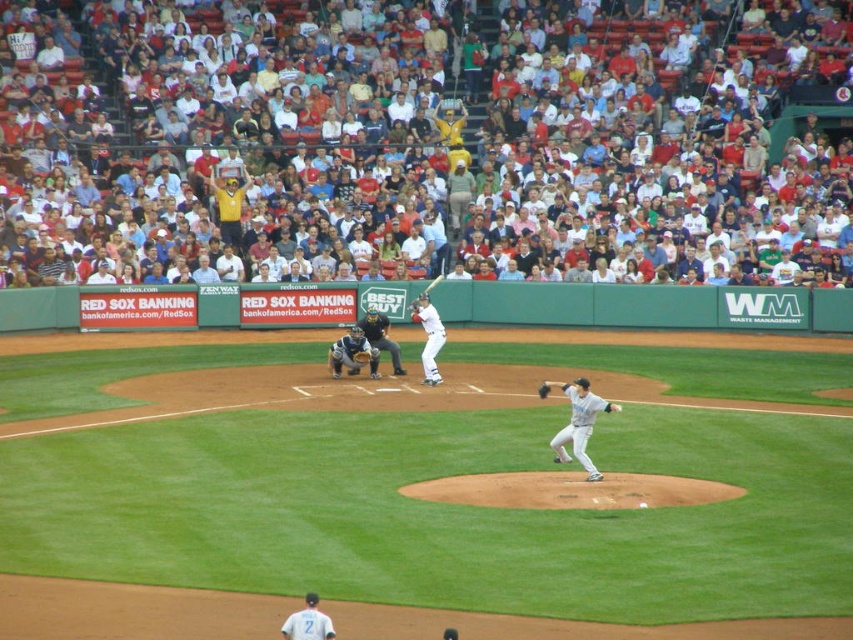
You are a baseball coach who wants to ensure proper positioning during a game. Given the distance between the blue leather catcher at center and the white jersey at center, is this distance within the standard MLB regulation of 60 feet, 6 inches between the pitcher and home plate?

The distance between the blue leather catcher at center and the white jersey at center is 49.75 feet, which is shorter than the MLB regulation of 60 feet, 6 inches. Therefore, the positioning is not compliant with the standard MLB regulation.

You are a baseball fan watching the game at Fenway Park. You notice two points marked on the field. The first point is at coordinate point(349, 358) and the second is at point(322, 625). From your perspective, which point is closer to the batter?

Point(322, 625) is closer to the batter because it is in front of point(349, 358).

You are a baseball fan watching the game at Fenway Park. You notice the blue leather catcher at center and the white jersey at center. Which object is positioned higher in the image?

The blue leather catcher at center is located above the white jersey at center, so it is positioned higher in the image.